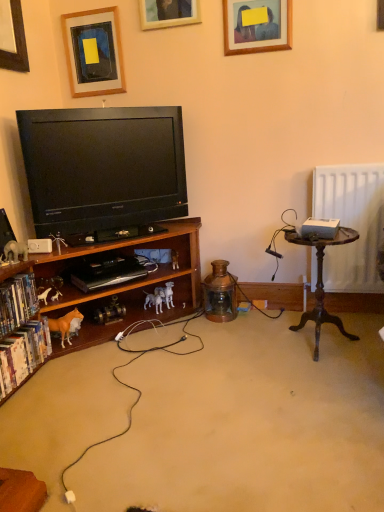
Identify the location of unoccupied area in front of hardcover book at lower left, which is the first book from bottom to top. This screenshot has height=512, width=384. (23, 417).